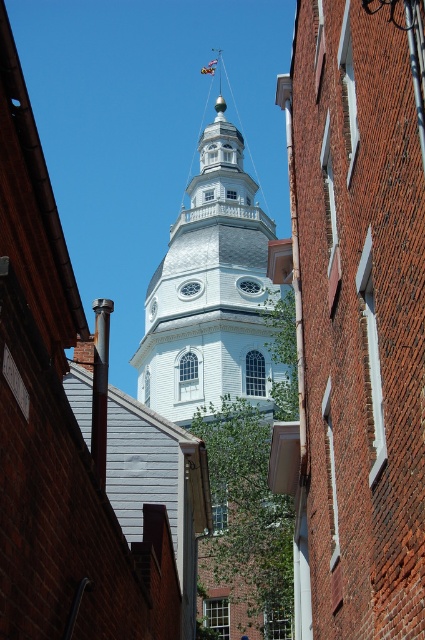
Question: Which object is the farthest from the blue fabric flag at upper center?

Choices:
 (A) brick church at center
 (B) white textured dome at center

Answer: (A)

Question: Is brick church at center positioned before blue fabric flag at upper center?

Choices:
 (A) no
 (B) yes

Answer: (B)

Question: Which point is closer to the camera?

Choices:
 (A) blue fabric flag at upper center
 (B) white textured dome at center

Answer: (B)

Question: Does white textured dome at center have a greater width compared to blue fabric flag at upper center?

Choices:
 (A) yes
 (B) no

Answer: (A)

Question: Which of the following is the closest to the observer?

Choices:
 (A) (308, 128)
 (B) (195, 212)
 (C) (207, 72)

Answer: (A)

Question: Can you confirm if brick church at center is thinner than white textured dome at center?

Choices:
 (A) yes
 (B) no

Answer: (A)